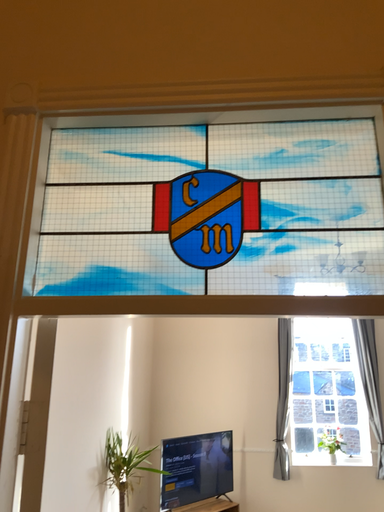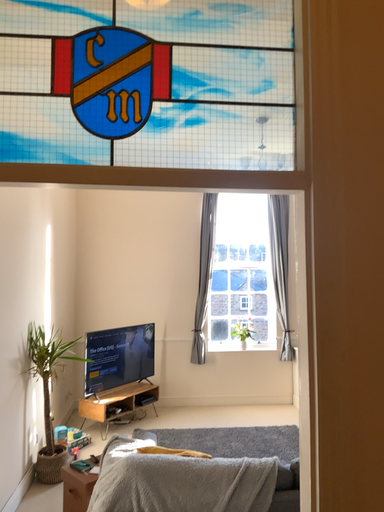
Question: Which way did the camera rotate in the video?

Choices:
 (A) rotated upward
 (B) rotated downward

Answer: (B)